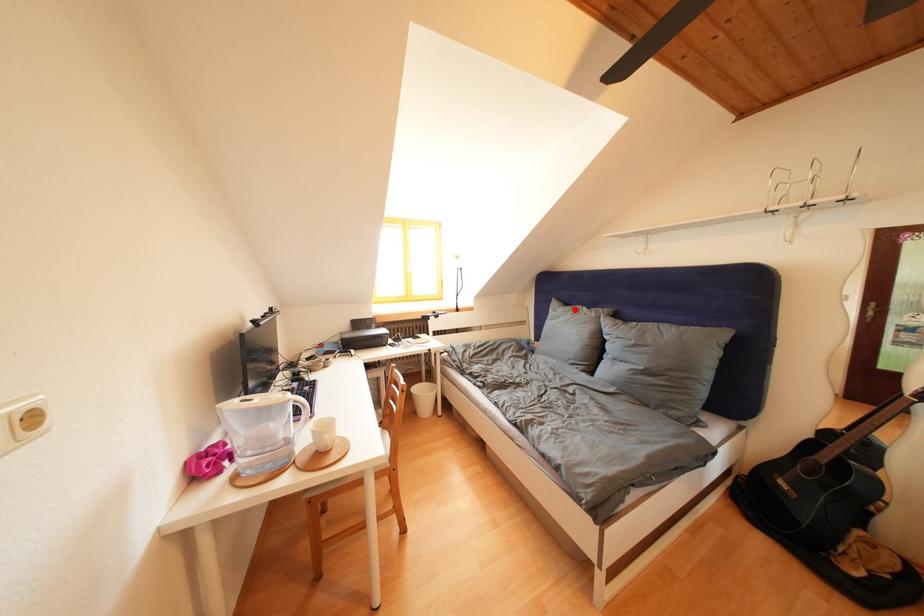
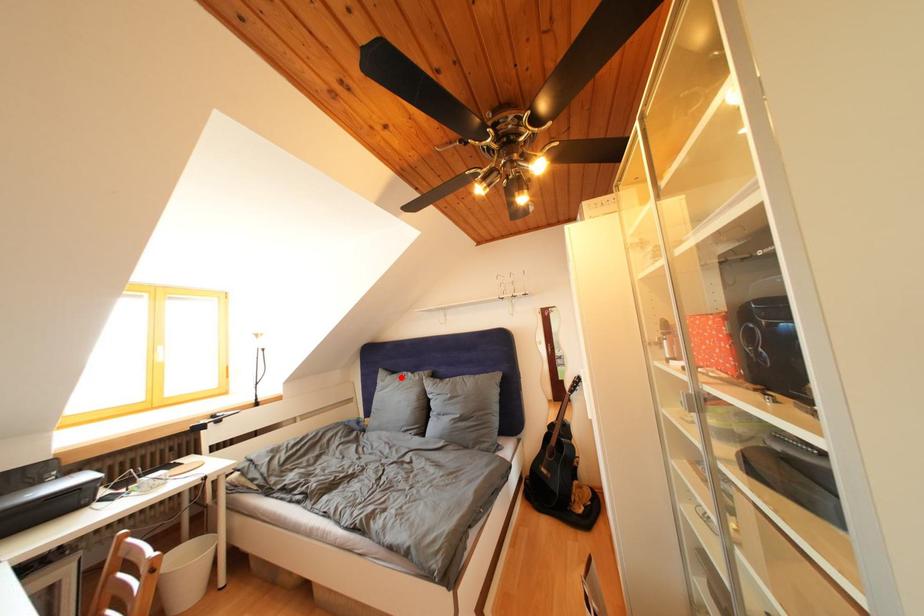
I am providing you with two images of the same scene from different viewpoints. A red point is marked on the first image and another point is marked on the second image. Are the points marked in image1 and image2 representing the same 3D position?

Yes